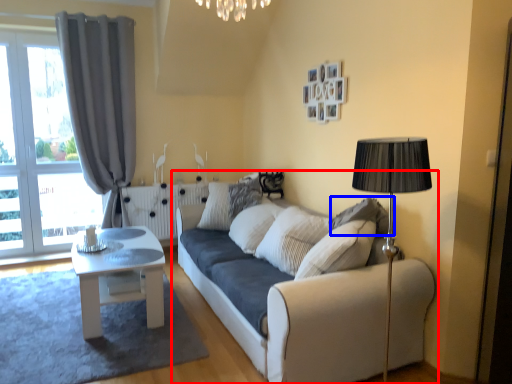
Question: Among these objects, which one is farthest to the camera, studio couch (highlighted by a red box) or pillow (highlighted by a blue box)?

Choices:
 (A) studio couch
 (B) pillow

Answer: (B)